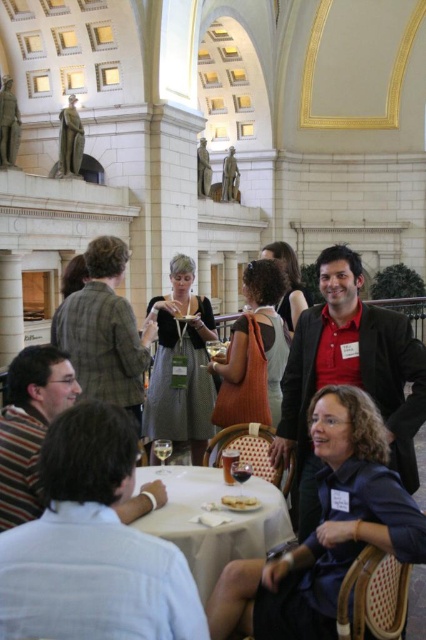
Question: Does white matte plate at center have a greater width compared to clear glass wine at center?

Choices:
 (A) yes
 (B) no

Answer: (A)

Question: Among these points, which one is nearest to the camera?

Choices:
 (A) (69, 120)
 (B) (5, 132)
 (C) (166, 458)

Answer: (C)

Question: Does matte red shirt at center have a smaller size compared to white cloth table at center?

Choices:
 (A) yes
 (B) no

Answer: (B)

Question: Is white cloth table at center closer to the viewer compared to clear glass wine glass at center?

Choices:
 (A) no
 (B) yes

Answer: (B)

Question: Which of the following is the closest to the observer?

Choices:
 (A) (170, 444)
 (B) (247, 465)

Answer: (B)

Question: Which of the following is the closest to the observer?

Choices:
 (A) (284, 524)
 (B) (247, 467)
 (C) (230, 163)
 (D) (233, 476)

Answer: (A)